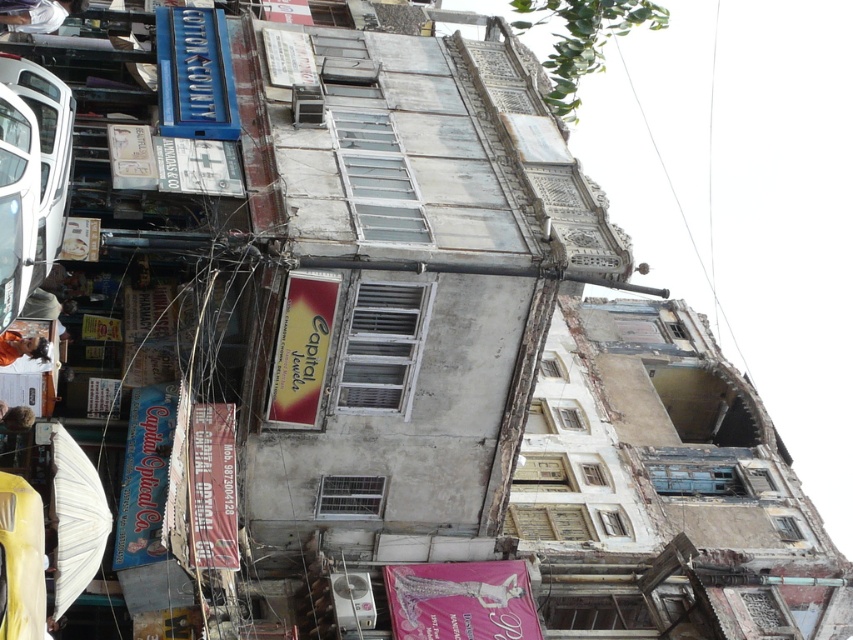
Can you confirm if white glossy car at left is bigger than light brown hair at lower left?

Indeed, white glossy car at left has a larger size compared to light brown hair at lower left.

Between white glossy car at left and light brown hair at lower left, which one appears on the right side from the viewer's perspective?

light brown hair at lower left is more to the right.

Is point (42, 260) in front of point (18, 419)?

Yes, it is.

What are the coordinates of `white glossy car at left` in the screenshot? It's located at (45, 145).

Is point (59, 216) positioned behind point (33, 19)?

No, it is not.

Which is more to the right, white glossy car at left or white fabric shirt at upper left?

white glossy car at left

Between point (56, 225) and point (38, 26), which one is positioned in front?

Positioned in front is point (56, 225).

Where is `white glossy car at left`? white glossy car at left is located at coordinates (45, 145).

Looking at this image, does metallic gold necklace at lower left have a lesser width compared to light brown hair at lower left?

No, metallic gold necklace at lower left is not thinner than light brown hair at lower left.

Can you confirm if metallic gold necklace at lower left is taller than light brown hair at lower left?

Correct, metallic gold necklace at lower left is much taller as light brown hair at lower left.

The height and width of the screenshot is (640, 853). Describe the element at coordinates (21, 348) in the screenshot. I see `metallic gold necklace at lower left` at that location.

The width and height of the screenshot is (853, 640). I want to click on metallic gold necklace at lower left, so click(x=21, y=348).